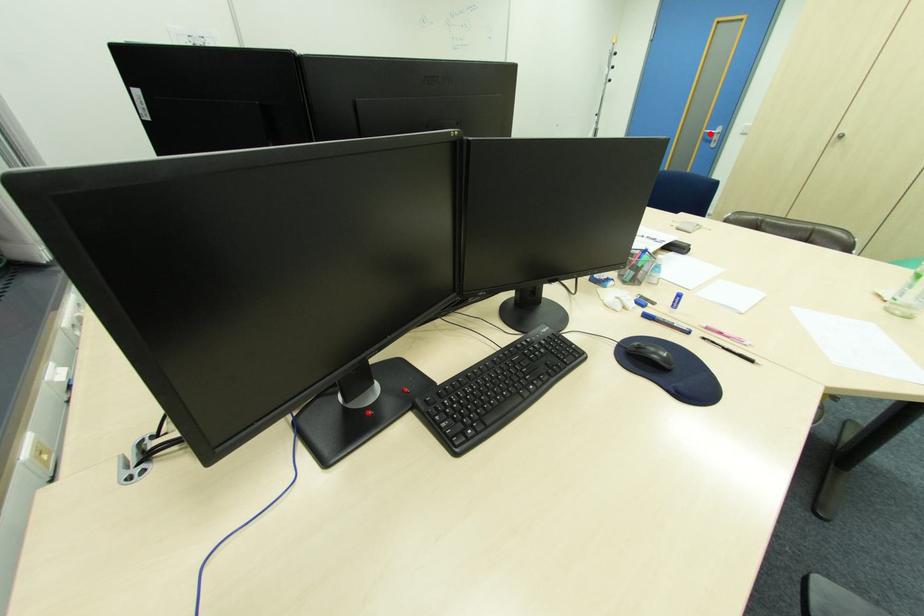
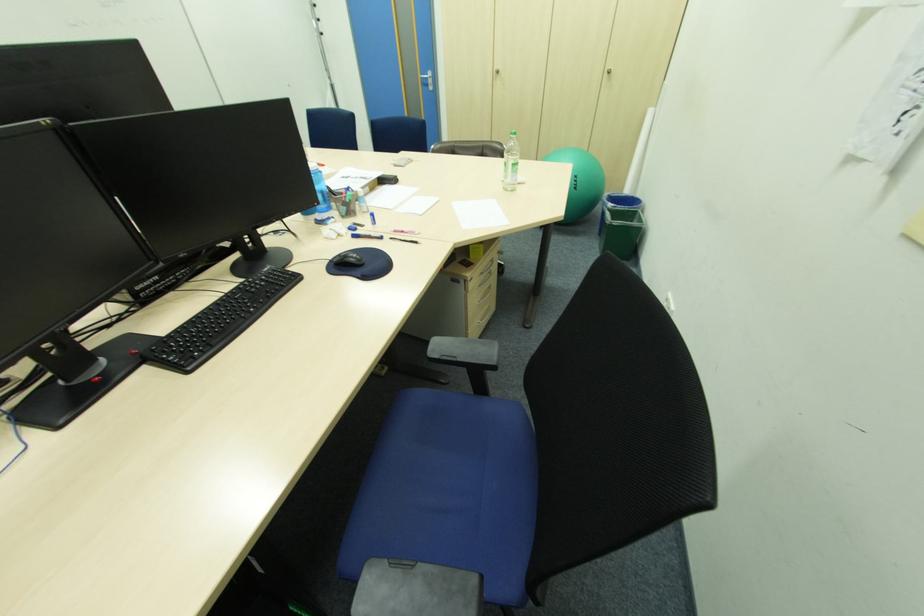
Question: I am providing you with two images of the same scene from different viewpoints. A red point is marked on the first image. Is the red point's position out of view in image 2?

Choices:
 (A) Yes
 (B) No

Answer: (B)